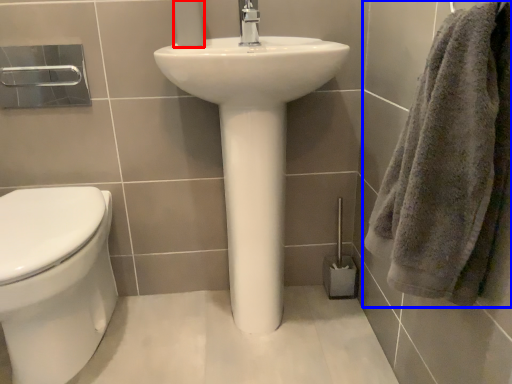
Question: Which object appears farthest to the camera in this image, toilet paper (highlighted by a red box) or towel (highlighted by a blue box)?

Choices:
 (A) toilet paper
 (B) towel

Answer: (A)